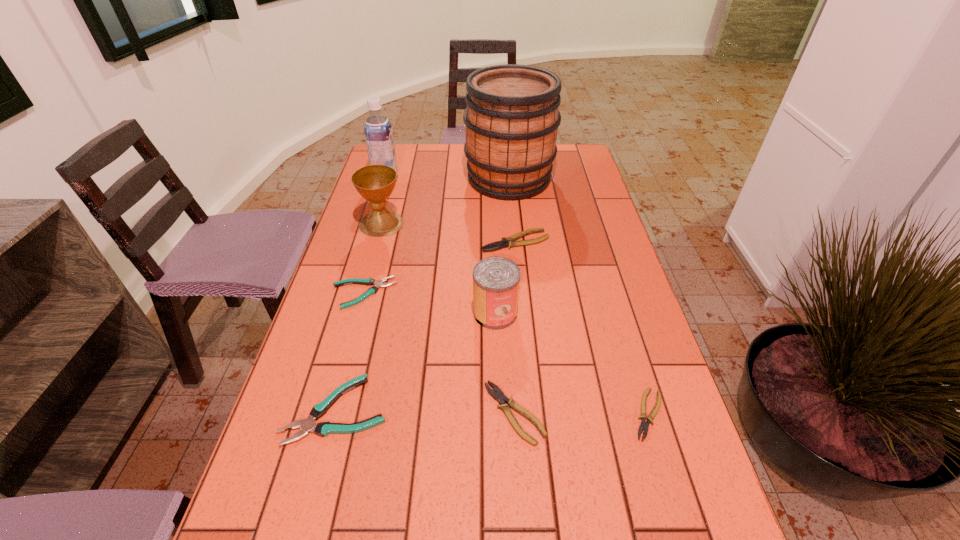
This screenshot has width=960, height=540. Find the location of `free space that satisfies the following two spatial constraints: 1. on the label of the eighth shortest object; 2. on the back side of the second smallest yellow pliers`. free space that satisfies the following two spatial constraints: 1. on the label of the eighth shortest object; 2. on the back side of the second smallest yellow pliers is located at coordinates (317, 413).

Find the location of a particular element. This screenshot has width=960, height=540. free space in the image that satisfies the following two spatial constraints: 1. on the label of the second tallest object; 2. on the right side of the nearer teal pliers is located at coordinates (318, 410).

The width and height of the screenshot is (960, 540). What are the coordinates of `vacant region that satisfies the following two spatial constraints: 1. on the back side of the second smallest yellow pliers; 2. on the label of the eighth shortest object` in the screenshot? It's located at (500, 179).